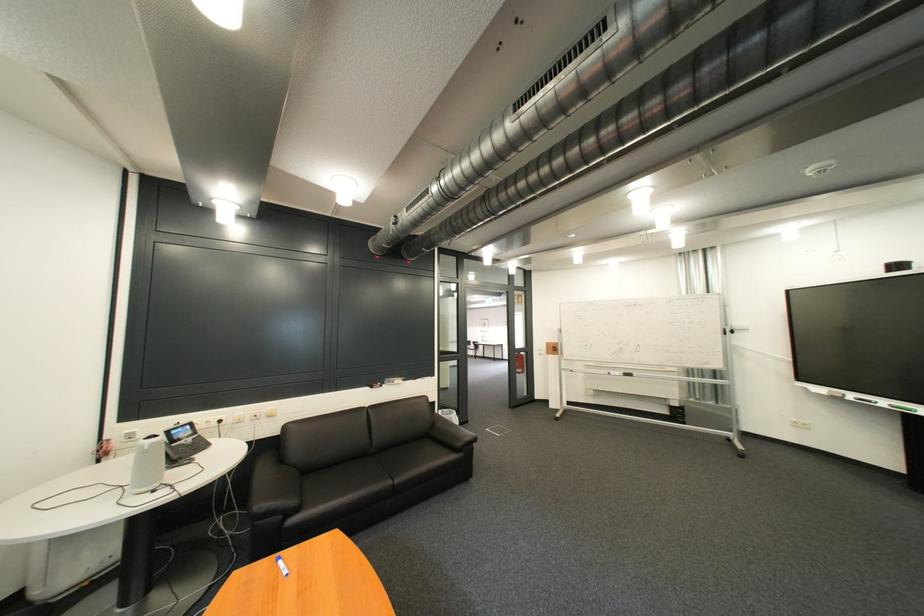
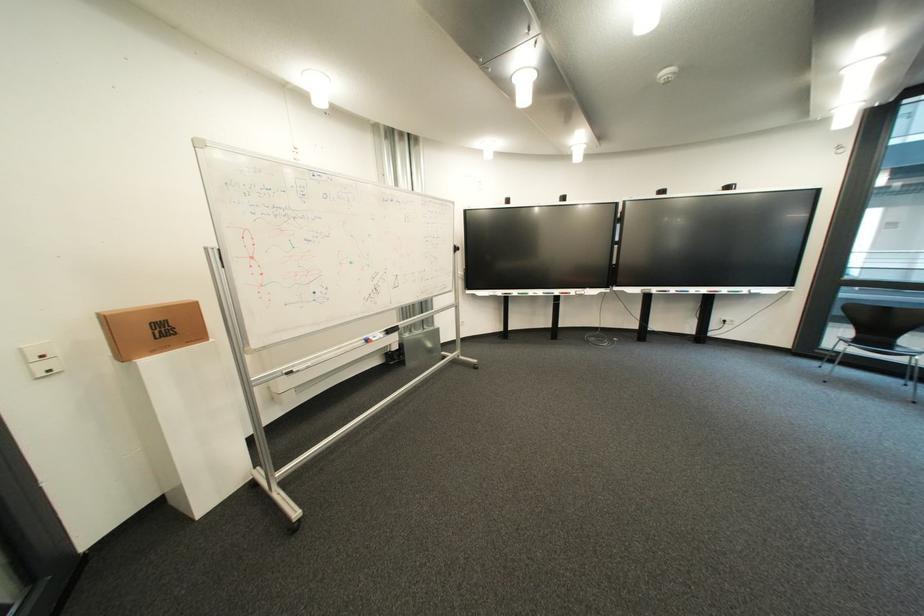
The point at (553,354) is marked in the first image. Where is the corresponding point in the second image?

(56, 368)